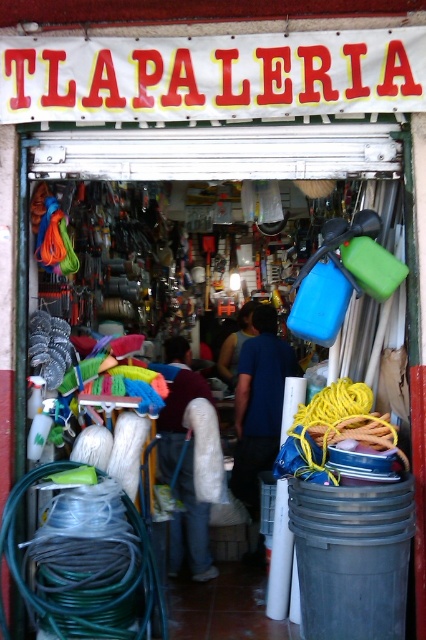
You are standing at the entrance of TLAPALERIA shop and see the blue fabric at center and the maroon fabric at center. Which fabric is positioned to the right side from your perspective?

The blue fabric at center is positioned to the right of the maroon fabric at center.

You are a customer entering the shop and need to reach the blue fabric shirt at center to check its price tag. Is the green rubber hose at lower left blocking your path?

The green rubber hose at lower left is in front of the blue fabric shirt at center, so it is blocking the path to the shirt.